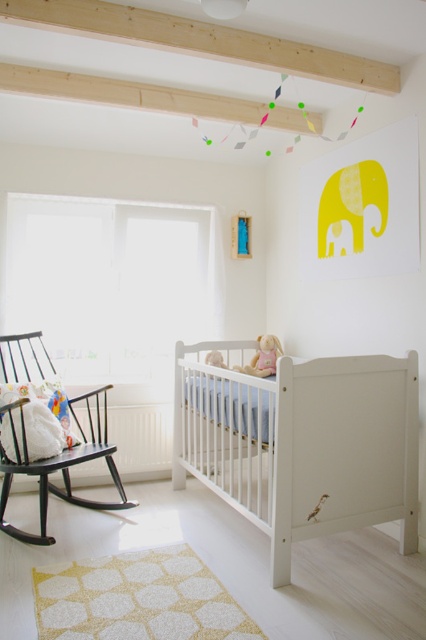
You are a parent holding a baby and want to move from the black wood rocking chair at left to the yellow matte baby elephant at center. Can you walk directly to the elephant without stepping over anything?

The distance between the black wood rocking chair at left and the yellow matte baby elephant at center is 3.52 feet, so yes, you can walk directly to the elephant without stepping over anything as there is enough space.

In the scene shown: You are a parent trying to place a new mobile above the crib. The mobile requires a height clearance of 60 cm. Given the white wooden crib at center and the yellow matte baby elephant at center, which object determines the minimum height requirement for the mobile installation?

The white wooden crib at center is taller than the yellow matte baby elephant at center, so the mobile must be installed above the white wooden crib at center to meet the height clearance requirement of 60 cm.

You are a parent trying to place a new toy in the nursery. You have a small stuffed animal that needs to fit between the white wooden crib at center and the soft pink fabric doll at upper center. Based on their sizes, can the stuffed animal fit in the space between them?

The white wooden crib at center might be wider than the soft pink fabric doll at upper center, so there may be enough space for the stuffed animal to fit between them. However, since the exact dimensions are not provided, it is recommended to measure the space before placing the toy.